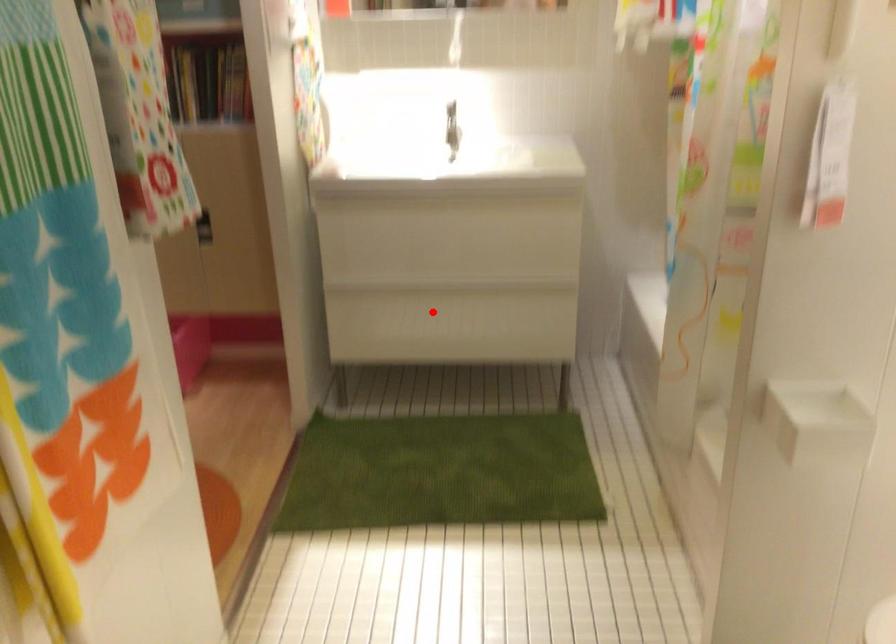
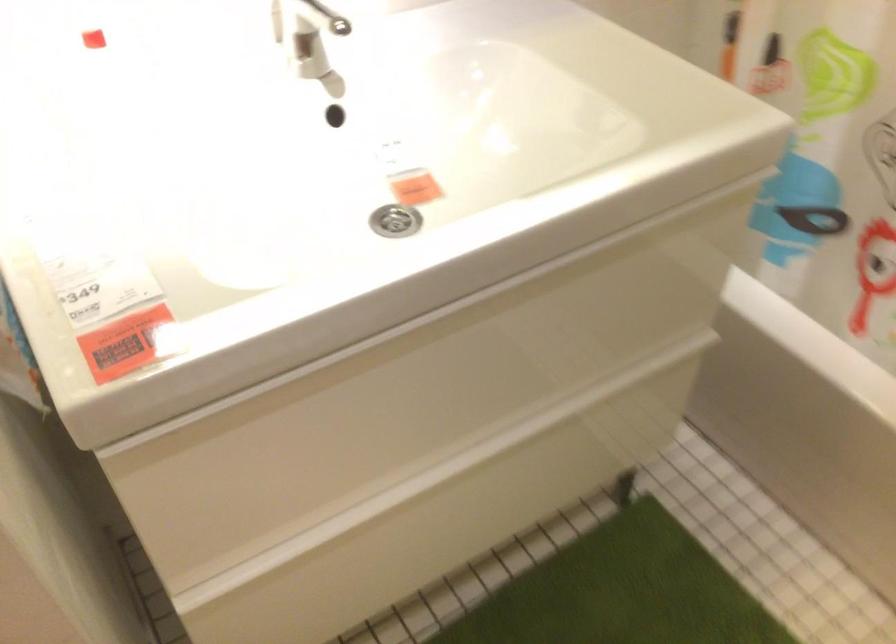
Question: I am providing you with two images of the same scene from different viewpoints. A red point is shown in image1. For the corresponding object point in image2, is it positioned nearer or farther from the camera?

Choices:
 (A) Nearer
 (B) Farther

Answer: (A)